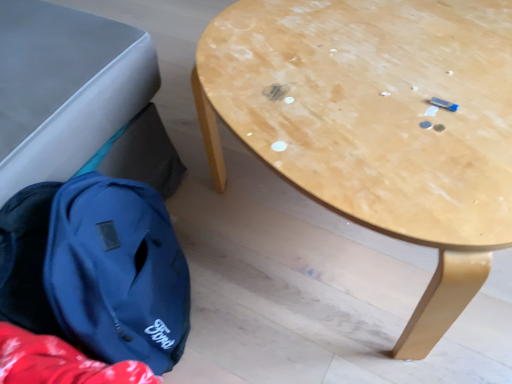
Question: Considering the positions of light brown wood table at center and matte blue backpack at lower left in the image, is light brown wood table at center bigger or smaller than matte blue backpack at lower left?

Choices:
 (A) small
 (B) big

Answer: (B)

Question: In the image, is light brown wood table at center positioned in front of or behind matte blue backpack at lower left?

Choices:
 (A) front
 (B) behind

Answer: (A)

Question: In terms of height, does light brown wood table at center look taller or shorter compared to matte blue backpack at lower left?

Choices:
 (A) tall
 (B) short

Answer: (A)

Question: Visually, is matte blue backpack at lower left positioned to the left or to the right of light brown wood table at center?

Choices:
 (A) left
 (B) right

Answer: (A)

Question: Is matte blue backpack at lower left inside or outside of light brown wood table at center?

Choices:
 (A) outside
 (B) inside

Answer: (A)

Question: Considering the positions of matte blue backpack at lower left and light brown wood table at center in the image, is matte blue backpack at lower left wider or thinner than light brown wood table at center?

Choices:
 (A) wide
 (B) thin

Answer: (B)

Question: Is matte blue backpack at lower left taller or shorter than light brown wood table at center?

Choices:
 (A) tall
 (B) short

Answer: (B)